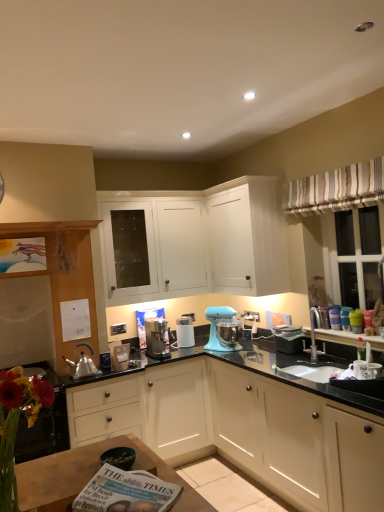
Question: Can you confirm if striped fabric curtain at upper right is positioned to the right of matte white cabinet at left, the 3th cabinetry in the top-to-bottom sequence?

Choices:
 (A) yes
 (B) no

Answer: (A)

Question: Is striped fabric curtain at upper right wider than matte white cabinet at left, arranged as the second cabinetry when ordered from the bottom?

Choices:
 (A) yes
 (B) no

Answer: (B)

Question: Does striped fabric curtain at upper right have a lesser width compared to matte white cabinet at left, arranged as the second cabinetry when ordered from the bottom?

Choices:
 (A) no
 (B) yes

Answer: (B)

Question: Is striped fabric curtain at upper right outside of matte white cabinet at left, arranged as the second cabinetry when ordered from the bottom?

Choices:
 (A) no
 (B) yes

Answer: (B)

Question: From a real-world perspective, does striped fabric curtain at upper right sit lower than matte white cabinet at left, the 3th cabinetry in the top-to-bottom sequence?

Choices:
 (A) no
 (B) yes

Answer: (A)

Question: Looking at their shapes, would you say matte white cabinet at left, arranged as the second cabinetry when ordered from the bottom, is wider or thinner than white matte cabinet at center, placed as the second cabinetry when sorted from top to bottom?

Choices:
 (A) wide
 (B) thin

Answer: (B)

Question: In the image, is matte white cabinet at left, the 3th cabinetry in the top-to-bottom sequence, on the left side or the right side of white matte cabinet at center, the 3th cabinetry ordered from the bottom?

Choices:
 (A) left
 (B) right

Answer: (A)

Question: Considering the positions of matte white cabinet at left, arranged as the second cabinetry when ordered from the bottom, and white matte cabinet at center, the 3th cabinetry ordered from the bottom, in the image, is matte white cabinet at left, arranged as the second cabinetry when ordered from the bottom, taller or shorter than white matte cabinet at center, the 3th cabinetry ordered from the bottom,?

Choices:
 (A) short
 (B) tall

Answer: (B)

Question: From the image's perspective, is matte white cabinet at left, the 3th cabinetry in the top-to-bottom sequence, above or below white matte cabinet at center, the 3th cabinetry ordered from the bottom?

Choices:
 (A) below
 (B) above

Answer: (A)

Question: Considering their positions, is printed paper magazine at lower center located in front of or behind white matte cabinet at center, the 3th cabinetry ordered from the bottom?

Choices:
 (A) front
 (B) behind

Answer: (A)

Question: Based on their positions, is printed paper magazine at lower center located to the left or right of white matte cabinet at center, placed as the second cabinetry when sorted from top to bottom?

Choices:
 (A) right
 (B) left

Answer: (A)

Question: From the image's perspective, is printed paper magazine at lower center positioned above or below white matte cabinet at center, placed as the second cabinetry when sorted from top to bottom?

Choices:
 (A) below
 (B) above

Answer: (A)

Question: Which is correct: printed paper magazine at lower center is inside white matte cabinet at center, placed as the second cabinetry when sorted from top to bottom, or outside of it?

Choices:
 (A) inside
 (B) outside

Answer: (B)

Question: From the image's perspective, is wooden table at lower left positioned above or below matte white cabinet at left, arranged as the second cabinetry when ordered from the bottom?

Choices:
 (A) above
 (B) below

Answer: (B)

Question: Considering their positions, is wooden table at lower left located in front of or behind matte white cabinet at left, the 3th cabinetry in the top-to-bottom sequence?

Choices:
 (A) behind
 (B) front

Answer: (B)